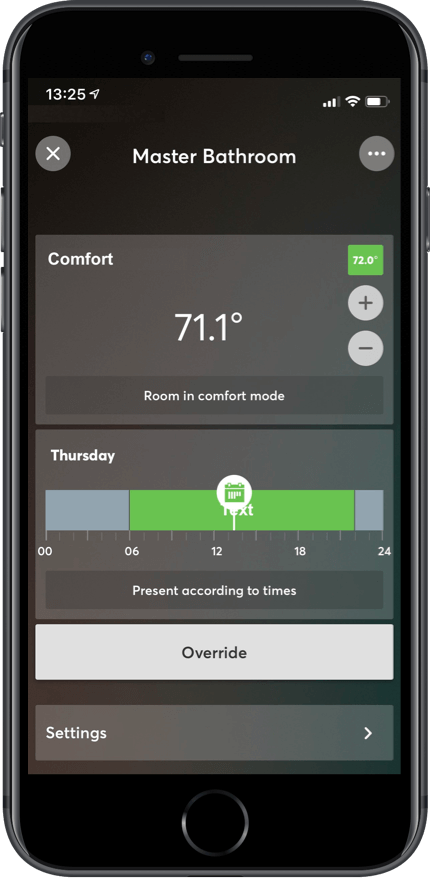
Find the location of a particular element. Image resolution: width=430 pixels, height=878 pixels. space above master bedroom is located at coordinates (204, 112).